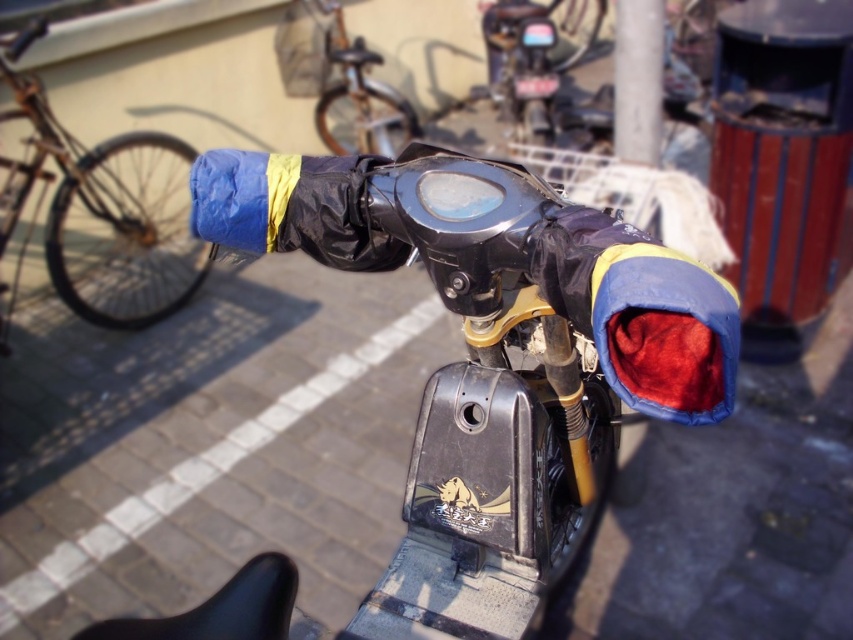
You are a mechanic working on a motorcycle. You need to replace the blue fabric handlebar cover at center and the blue fabric handlebar cover at left. If your tool kit can only reach up to 6 feet, will you be able to reach both covers without moving the toolkit?

The distance between the blue fabric handlebar cover at center and the blue fabric handlebar cover at left is 6.29 feet. Since your toolkit can only reach up to 6 feet, you will not be able to reach both covers without moving the toolkit.